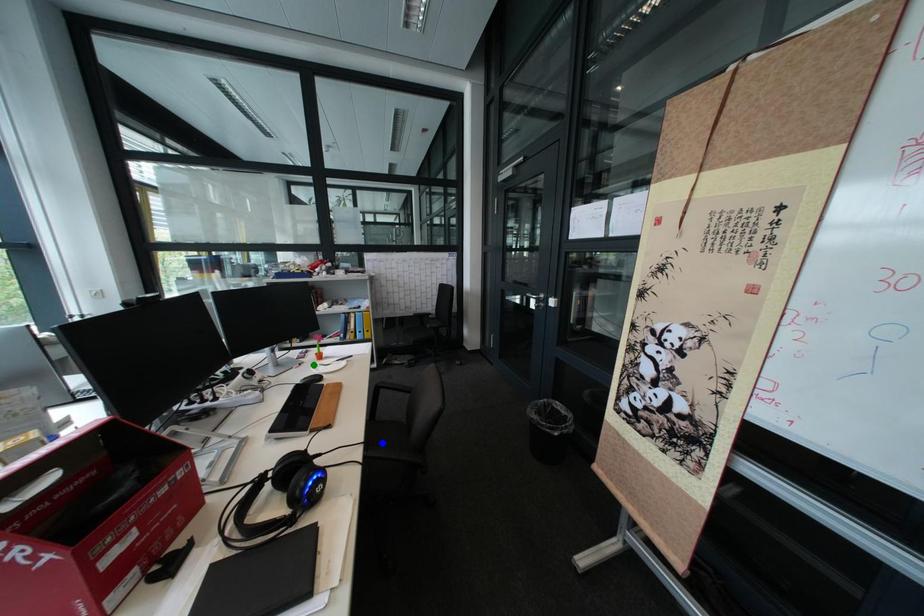
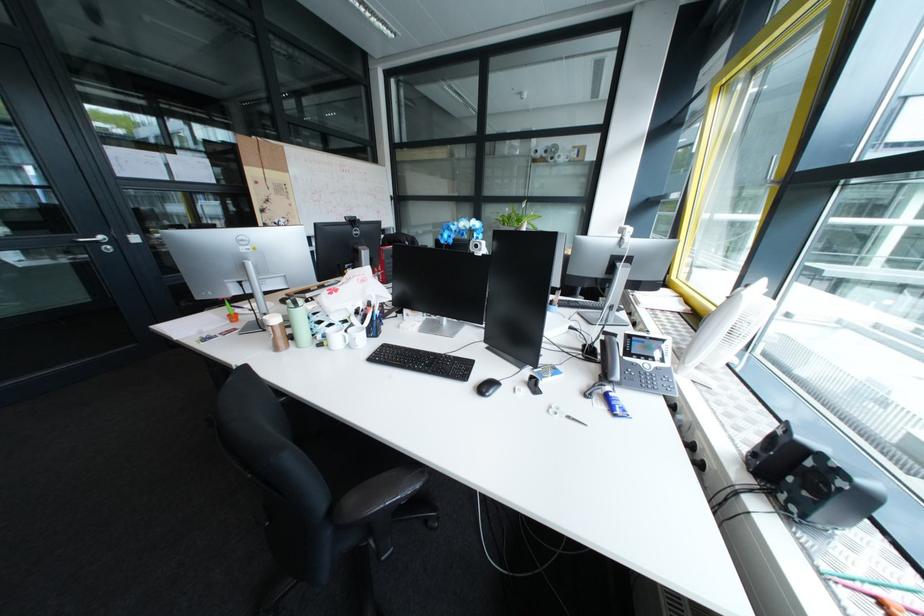
I am providing you with two images of the same scene from different viewpoints. Three points are marked in image1. Which point corresponds to a part or object that is occluded in image2?In image1, three points are marked. Which of them correspond to a part or object that is occluded in image2?Among the three points shown in image1, which one corresponds to a part or object that is no longer visible due to occlusion in image2?

Invisible in image2: yellow point, blue point, green point.